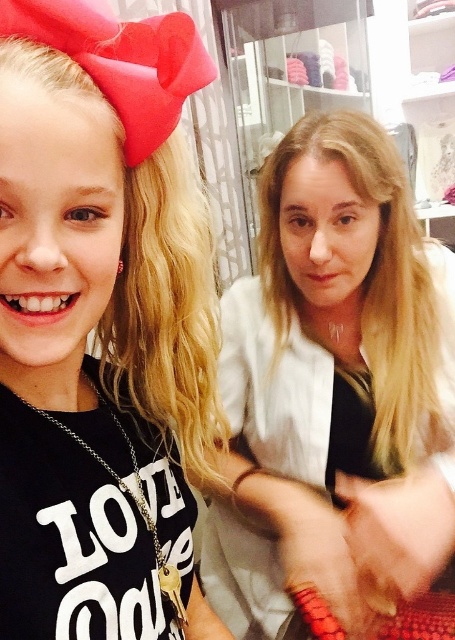
Question: Which point is closer to the camera?

Choices:
 (A) smooth white blouse at center
 (B) matte black shirt at left

Answer: (B)

Question: Where is matte black shirt at left located in relation to smooth white blouse at center in the image?

Choices:
 (A) below
 (B) above

Answer: (B)

Question: Which object appears farthest from the camera in this image?

Choices:
 (A) smooth white blouse at center
 (B) matte black shirt at left

Answer: (A)

Question: Where is matte black shirt at left located in relation to smooth white blouse at center in the image?

Choices:
 (A) left
 (B) right

Answer: (A)

Question: Is matte black shirt at left to the left of smooth white blouse at center from the viewer's perspective?

Choices:
 (A) yes
 (B) no

Answer: (A)

Question: Which object is farther from the camera taking this photo?

Choices:
 (A) matte black shirt at left
 (B) smooth white blouse at center

Answer: (B)